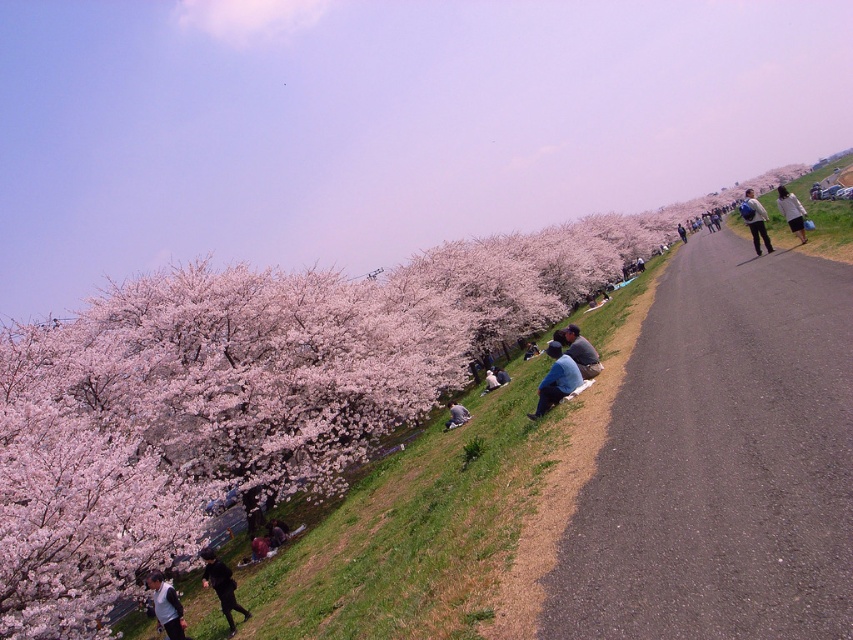
Question: Does dark gray jacket at lower left appear on the left side of light blue denim jeans at center?

Choices:
 (A) no
 (B) yes

Answer: (B)

Question: Which of these objects is positioned farthest from the dark brown leather jacket at lower center?

Choices:
 (A) light blue denim jacket at right
 (B) denim jeans at center

Answer: (A)

Question: Which point is closer to the camera?

Choices:
 (A) light gray sweater at right
 (B) dark brown leather jacket at lower center

Answer: (B)

Question: Observing the image, what is the correct spatial positioning of pink blossoms at upper left in reference to denim jacket at lower center?

Choices:
 (A) above
 (B) below

Answer: (A)

Question: Which of these objects is positioned closest to the dark brown leather jacket at lower center?

Choices:
 (A) denim jacket at lower center
 (B) black matte jacket at lower left
 (C) asphalt road at center
 (D) pink blossoms at upper left

Answer: (B)

Question: In this image, where is asphalt road at center located relative to denim jacket at lower center?

Choices:
 (A) above
 (B) below

Answer: (A)